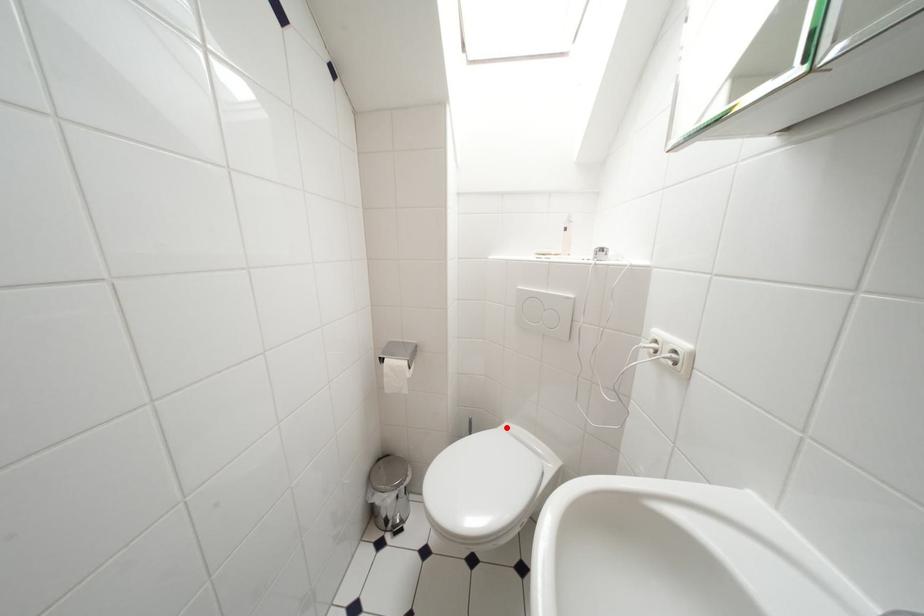
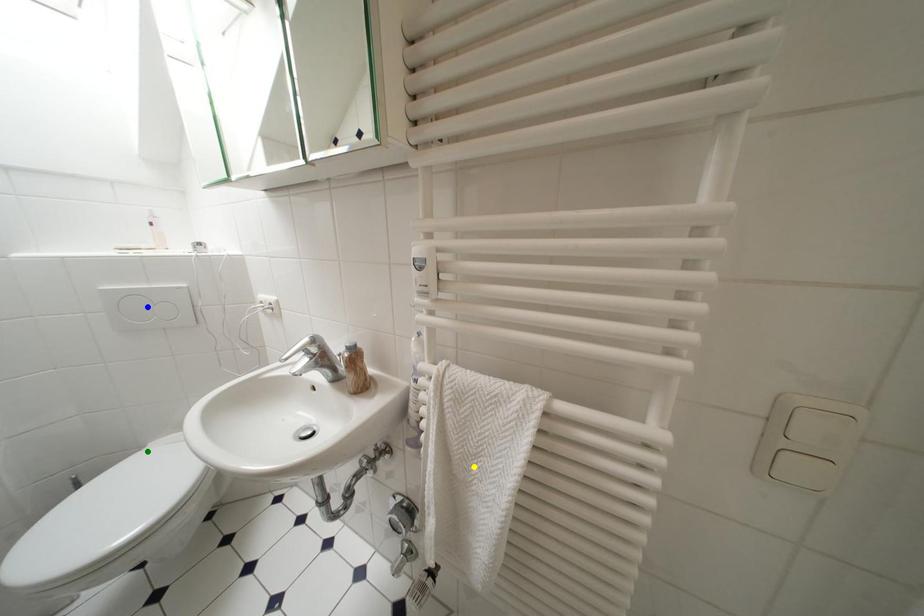
Question: I am providing you with two images of the same scene from different viewpoints. A red point is marked on the first image. You are given multiple points on the second image. Which point in image 2 represents the same 3d spot as the red point in image 1?

Choices:
 (A) yellow point
 (B) green point
 (C) blue point

Answer: (B)